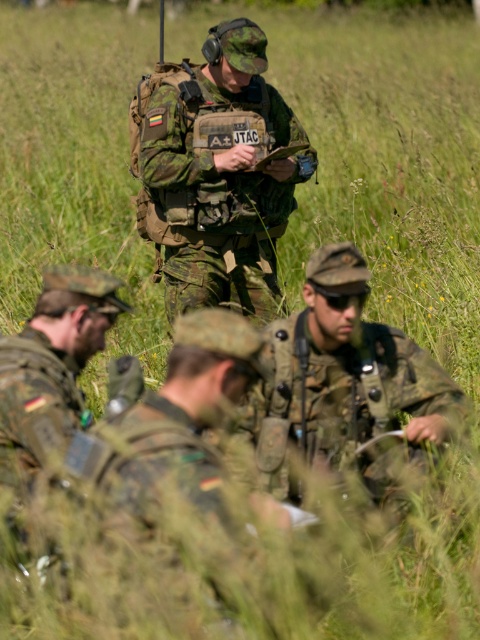
In the scene shown: You are a military observer analyzing the soldiers in the image. Which soldier is wearing a camouflage fabric uniform at center that is layered over another camouflage uniform at center?

The camouflage fabric uniform at center is layered over the camouflage uniform at center, so the soldier wearing the camouflage fabric uniform at center has a layered uniform.

You are a military observer analyzing the image. Based on the camouflage fabric uniform at center and the camouflage uniform at lower left, which one is taller in the image?

The camouflage fabric uniform at center is taller than the camouflage uniform at lower left according to the description.

You are a military analyst observing the soldiers in the grassy field. Which soldier, the camouflage uniform at center or the camouflage uniform at lower left, is closer to the ground?

The camouflage uniform at center is positioned under the camouflage uniform at lower left, so the camouflage uniform at center is closer to the ground.